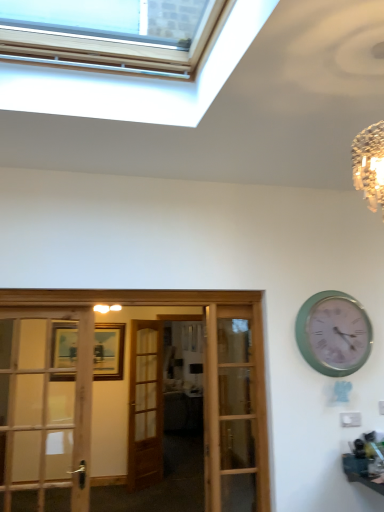
Question: Can you confirm if velvet brown couch at center is positioned to the right of wooden french doors at center?

Choices:
 (A) no
 (B) yes

Answer: (B)

Question: Is the position of velvet brown couch at center less distant than that of wooden french doors at center?

Choices:
 (A) yes
 (B) no

Answer: (B)

Question: Is velvet brown couch at center not close to wooden french doors at center?

Choices:
 (A) no
 (B) yes

Answer: (B)

Question: Is velvet brown couch at center oriented away from wooden french doors at center?

Choices:
 (A) no
 (B) yes

Answer: (A)

Question: Is velvet brown couch at center further to camera compared to wooden french doors at center?

Choices:
 (A) no
 (B) yes

Answer: (B)

Question: Is green metallic clock at upper right bigger or smaller than wooden door at center?

Choices:
 (A) big
 (B) small

Answer: (B)

Question: Considering their positions, is green metallic clock at upper right located in front of or behind wooden door at center?

Choices:
 (A) behind
 (B) front

Answer: (B)

Question: Is green metallic clock at upper right inside or outside of wooden door at center?

Choices:
 (A) inside
 (B) outside

Answer: (B)

Question: From a real-world perspective, is green metallic clock at upper right positioned above or below wooden door at center?

Choices:
 (A) above
 (B) below

Answer: (A)

Question: In the image, is wooden door at center on the left side or the right side of velvet brown couch at center?

Choices:
 (A) left
 (B) right

Answer: (A)

Question: Looking at the image, does wooden door at center seem bigger or smaller compared to velvet brown couch at center?

Choices:
 (A) big
 (B) small

Answer: (B)

Question: From the image's perspective, relative to velvet brown couch at center, is wooden door at center above or below?

Choices:
 (A) below
 (B) above

Answer: (B)

Question: Considering the positions of wooden door at center and velvet brown couch at center in the image, is wooden door at center wider or thinner than velvet brown couch at center?

Choices:
 (A) thin
 (B) wide

Answer: (A)

Question: In terms of height, does velvet brown couch at center look taller or shorter compared to green metallic clock at upper right?

Choices:
 (A) short
 (B) tall

Answer: (B)

Question: From the image's perspective, is velvet brown couch at center positioned above or below green metallic clock at upper right?

Choices:
 (A) above
 (B) below

Answer: (B)